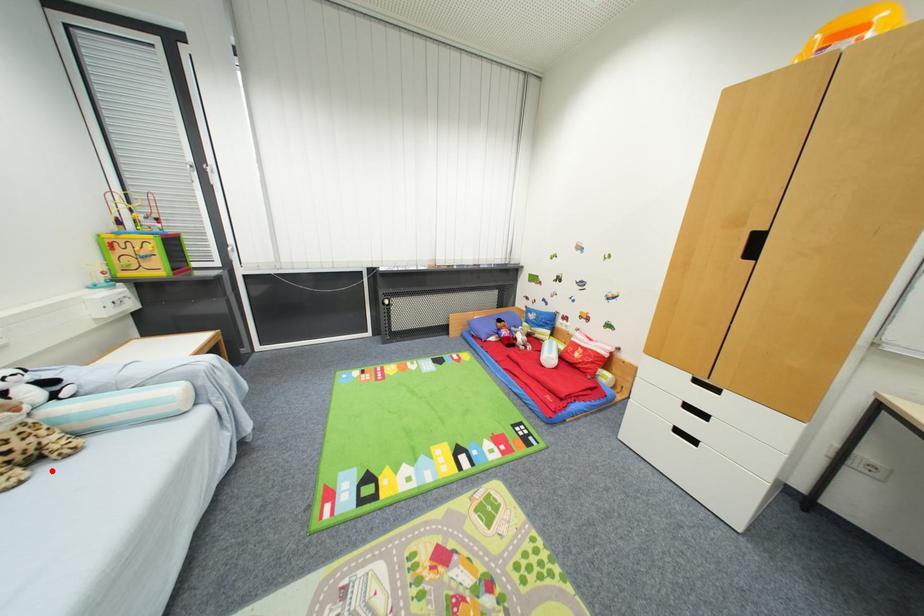
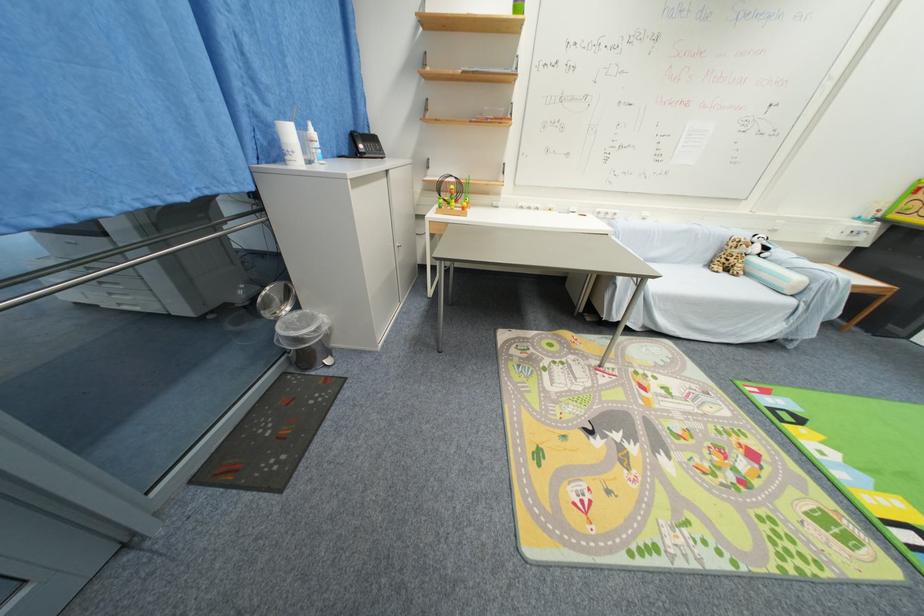
In the second image, find the point that corresponds to the highlighted location in the first image.

(730, 276)